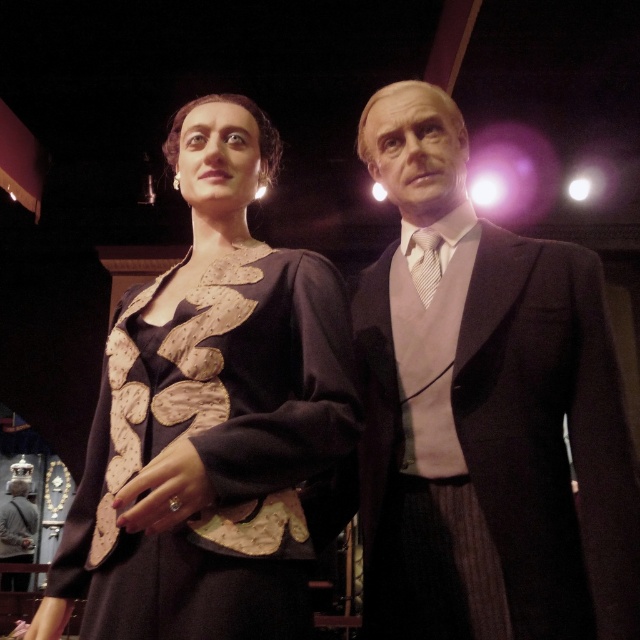
Question: Which point is closer to the camera?

Choices:
 (A) (209, 179)
 (B) (609, 621)

Answer: (B)

Question: Where is matte black suit at right located in relation to matte black dress at center in the image?

Choices:
 (A) above
 (B) below

Answer: (B)

Question: Which point is closer to the camera?

Choices:
 (A) matte black suit at right
 (B) matte black dress at center

Answer: (B)

Question: Can you confirm if matte black suit at right is positioned to the left of matte black dress at center?

Choices:
 (A) yes
 (B) no

Answer: (B)

Question: Can you confirm if matte black suit at right is thinner than matte black dress at center?

Choices:
 (A) yes
 (B) no

Answer: (A)